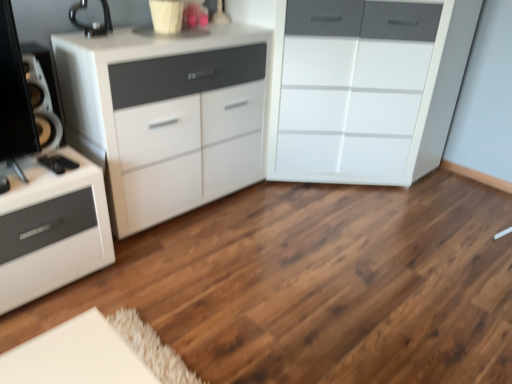
Question: Considering the positions of point (416, 107) and point (135, 36), is point (416, 107) closer or farther from the camera than point (135, 36)?

Choices:
 (A) closer
 (B) farther

Answer: (B)

Question: From a real-world perspective, is white glossy chest of drawers at center, placed as the 2th chest of drawers when sorted from left to right, above or below white glossy cabinet at upper left, which is the first chest of drawers in left-to-right order?

Choices:
 (A) below
 (B) above

Answer: (B)

Question: Considering their positions, is white glossy chest of drawers at center, placed as the first chest of drawers when sorted from right to left, located in front of or behind white glossy cabinet at upper left, which is the first chest of drawers in left-to-right order?

Choices:
 (A) front
 (B) behind

Answer: (B)

Question: Based on their positions, is white glossy cabinet at upper left, the 2th chest of drawers from the right, located to the left or right of white glossy chest of drawers at center, placed as the 2th chest of drawers when sorted from left to right?

Choices:
 (A) right
 (B) left

Answer: (B)

Question: Is point (150, 84) closer or farther from the camera than point (373, 36)?

Choices:
 (A) closer
 (B) farther

Answer: (A)

Question: Is white glossy cabinet at upper left, which is the first chest of drawers in left-to-right order, wider or thinner than white glossy chest of drawers at center, placed as the 2th chest of drawers when sorted from left to right?

Choices:
 (A) wide
 (B) thin

Answer: (B)

Question: Considering their positions, is white glossy cabinet at upper left, which is the first chest of drawers in left-to-right order, located in front of or behind white glossy chest of drawers at center, placed as the 2th chest of drawers when sorted from left to right?

Choices:
 (A) front
 (B) behind

Answer: (A)